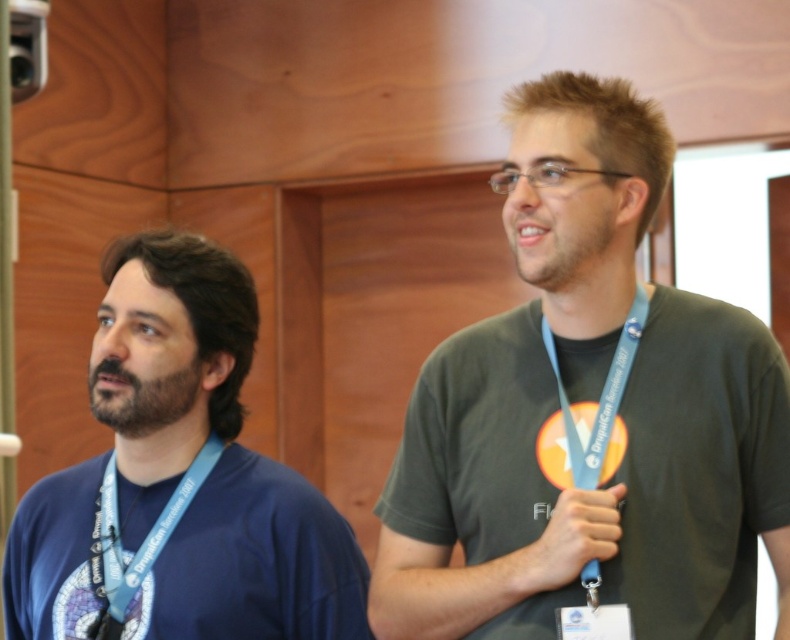
Question: Does blue fabric shirt at left have a smaller size compared to beardsoft hairman's neck at left?

Choices:
 (A) yes
 (B) no

Answer: (B)

Question: Can you confirm if blue fabric shirt at left is positioned below beardsoft hairman's neck at left?

Choices:
 (A) no
 (B) yes

Answer: (B)

Question: Is blue fabric shirt at left wider than blue fabric lanyard at left?

Choices:
 (A) no
 (B) yes

Answer: (B)

Question: Which object appears farthest from the camera in this image?

Choices:
 (A) matte gray lanyard at center
 (B) blue fabric lanyard at left

Answer: (B)

Question: Considering the real-world distances, which object is farthest from the blue fabric lanyard at right?

Choices:
 (A) beardsoft hairman's neck at left
 (B) matte gray lanyard at center
 (C) blue fabric lanyard at left

Answer: (C)

Question: Among these objects, which one is nearest to the camera?

Choices:
 (A) dark green t-shirt at center
 (B) blue fabric shirt at left
 (C) blue fabric lanyard at left
 (D) matte gray lanyard at center

Answer: (A)